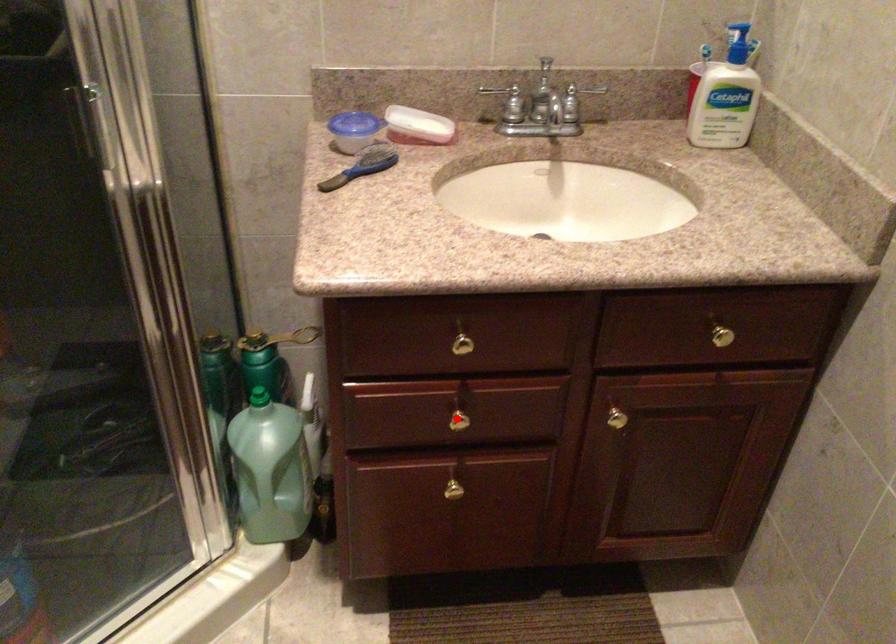
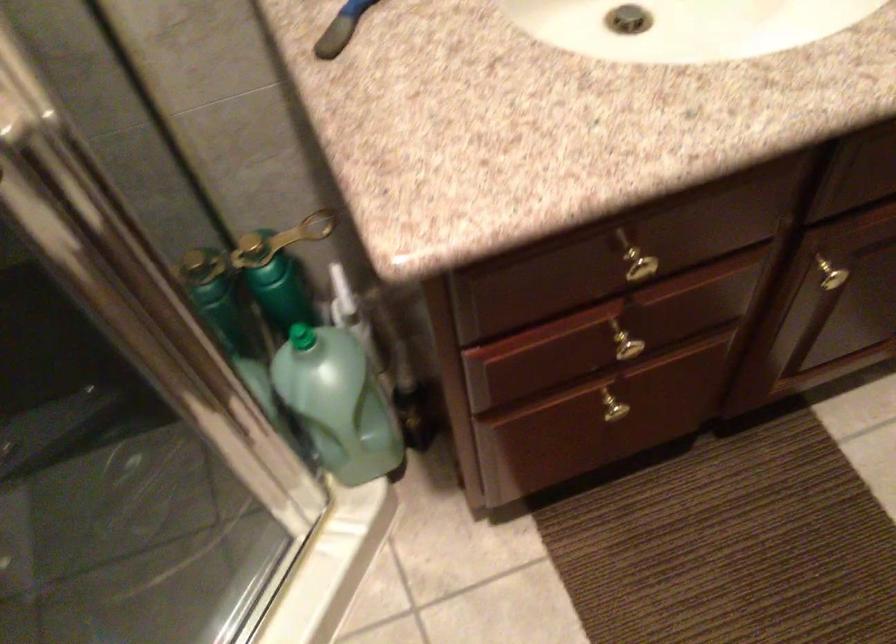
Question: I am providing you with two images of the same scene from different viewpoints. A red point is shown in image1. For the corresponding object point in image2, is it positioned nearer or farther from the camera?

Choices:
 (A) Nearer
 (B) Farther

Answer: (A)